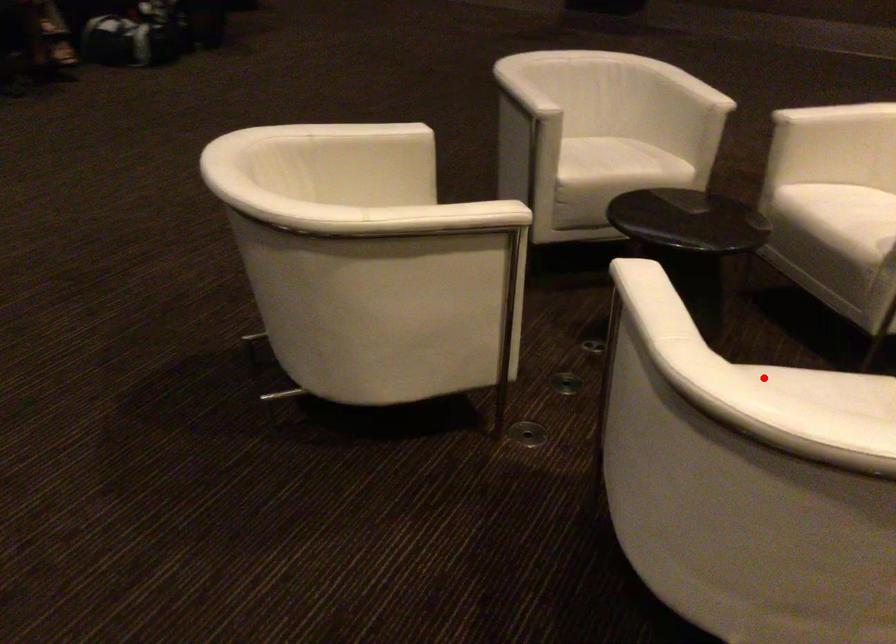
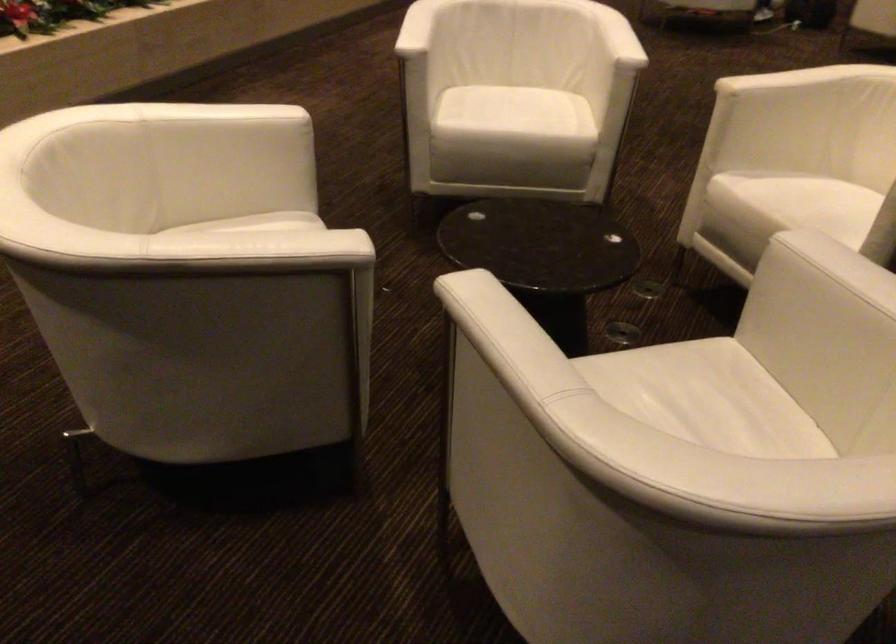
Question: A red point is marked in image1. In image2, is the corresponding 3D point closer to the camera or farther? Reply with the corresponding letter.

Choices:
 (A) The corresponding 3D point is closer.
 (B) The corresponding 3D point is farther.

Answer: (B)